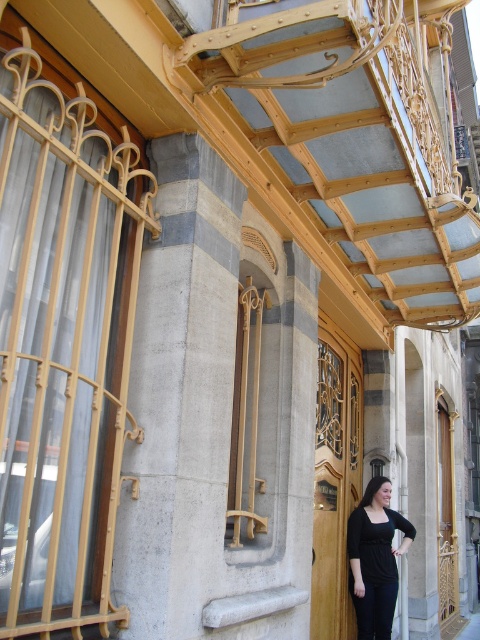
Question: Is gray stone column at center below black matte dress at lower right?

Choices:
 (A) no
 (B) yes

Answer: (A)

Question: Is wooden rail at left above gray stone column at center?

Choices:
 (A) yes
 (B) no

Answer: (A)

Question: Does wooden rail at left have a larger size compared to gray stone column at center?

Choices:
 (A) yes
 (B) no

Answer: (A)

Question: Which object is closer to the camera taking this photo?

Choices:
 (A) white concrete pavement at lower right
 (B) gray stone column at center

Answer: (B)

Question: Which object is positioned closest to the wooden rail at left?

Choices:
 (A) gray stone column at center
 (B) white concrete pavement at lower right

Answer: (A)

Question: Which object appears farthest from the camera in this image?

Choices:
 (A) white concrete pavement at lower right
 (B) black matte dress at lower right
 (C) gray stone column at center

Answer: (A)